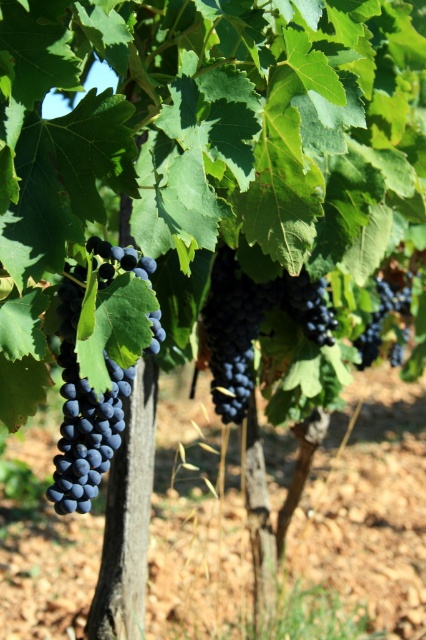
Question: Which of the following is the farthest from the observer?

Choices:
 (A) (376, 353)
 (B) (92, 472)
 (C) (242, 371)

Answer: (A)

Question: Does shiny dark blue grapes at center-left appear under dark matte grapes at center?

Choices:
 (A) yes
 (B) no

Answer: (A)

Question: Is shiny dark purple grapes at center further to the viewer compared to dark matte grapes at center?

Choices:
 (A) no
 (B) yes

Answer: (A)

Question: Estimate the real-world distances between objects in this image. Which object is farther from the dark matte grapes at center?

Choices:
 (A) shiny dark blue grapes at center-left
 (B) shiny dark purple grapes at center

Answer: (A)

Question: Which object is positioned closest to the shiny dark blue grapes at center-left?

Choices:
 (A) dark matte grapes at center
 (B) shiny dark purple grapes at center

Answer: (B)

Question: Does shiny dark blue grapes at center-left have a lesser width compared to shiny dark purple grapes at center?

Choices:
 (A) yes
 (B) no

Answer: (A)